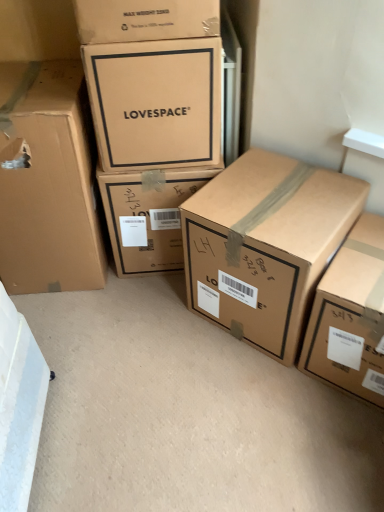
Question: Is matte cardboard box at upper center, the fourth box positioned from the right, not within matte cardboard box at center, positioned as the third box in left-to-right order?

Choices:
 (A) no
 (B) yes

Answer: (B)

Question: Does matte cardboard box at upper center, placed as the second box when sorted from left to right, have a lesser width compared to matte cardboard box at center, the 3th box in the right-to-left sequence?

Choices:
 (A) no
 (B) yes

Answer: (B)

Question: From a real-world perspective, is matte cardboard box at upper center, the fourth box positioned from the right, located higher than matte cardboard box at center, the 3th box in the right-to-left sequence?

Choices:
 (A) no
 (B) yes

Answer: (B)

Question: Does matte cardboard box at upper center, placed as the second box when sorted from left to right, have a greater height compared to matte cardboard box at center, the 3th box in the right-to-left sequence?

Choices:
 (A) yes
 (B) no

Answer: (B)

Question: Does matte cardboard box at upper center, the fourth box positioned from the right, have a lesser height compared to matte cardboard box at center, the 3th box in the right-to-left sequence?

Choices:
 (A) no
 (B) yes

Answer: (B)

Question: From the image's perspective, is matte cardboard box at left, the 5th box in the right-to-left sequence, positioned above or below brown cardboard box at lower right, which is counted as the first box, starting from the right?

Choices:
 (A) below
 (B) above

Answer: (B)

Question: Is matte cardboard box at left, marked as the 1th box in a left-to-right arrangement, taller or shorter than brown cardboard box at lower right, which is counted as the first box, starting from the right?

Choices:
 (A) tall
 (B) short

Answer: (A)

Question: Would you say matte cardboard box at left, marked as the 1th box in a left-to-right arrangement, is inside or outside brown cardboard box at lower right, the 5th box when ordered from left to right?

Choices:
 (A) inside
 (B) outside

Answer: (B)

Question: Considering the relative positions of matte cardboard box at left, marked as the 1th box in a left-to-right arrangement, and brown cardboard box at lower right, the 5th box when ordered from left to right, in the image provided, is matte cardboard box at left, marked as the 1th box in a left-to-right arrangement, to the left or to the right of brown cardboard box at lower right, the 5th box when ordered from left to right,?

Choices:
 (A) left
 (B) right

Answer: (A)

Question: In the image, is matte cardboard box at upper center, the fourth box positioned from the right, on the left side or the right side of brown cardboard box at center, the 2th box in the right-to-left sequence?

Choices:
 (A) right
 (B) left

Answer: (B)

Question: Is matte cardboard box at upper center, the fourth box positioned from the right, spatially inside brown cardboard box at center, the 2th box in the right-to-left sequence, or outside of it?

Choices:
 (A) inside
 (B) outside

Answer: (B)

Question: Is matte cardboard box at upper center, the fourth box positioned from the right, wider or thinner than brown cardboard box at center, which ranks as the 4th box in left-to-right order?

Choices:
 (A) thin
 (B) wide

Answer: (A)

Question: Is point (145, 47) positioned closer to the camera than point (289, 274)?

Choices:
 (A) closer
 (B) farther

Answer: (B)

Question: From the image's perspective, is brown cardboard box at lower right, which is counted as the first box, starting from the right, located above or below matte cardboard box at left, the 5th box in the right-to-left sequence?

Choices:
 (A) below
 (B) above

Answer: (A)

Question: In terms of size, does brown cardboard box at lower right, the 5th box when ordered from left to right, appear bigger or smaller than matte cardboard box at left, marked as the 1th box in a left-to-right arrangement?

Choices:
 (A) big
 (B) small

Answer: (B)